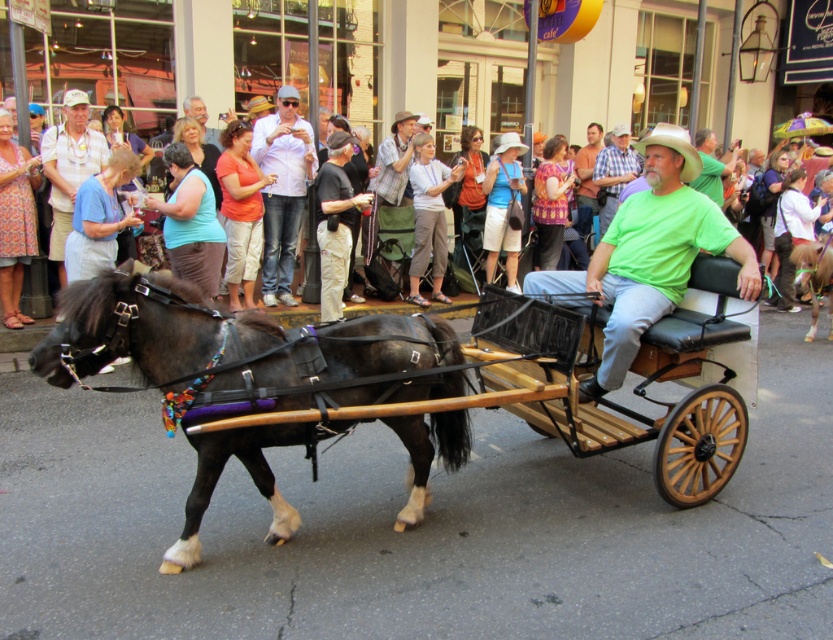
Question: Can you confirm if matte black horse at lower left is wider than gray hair at upper center?

Choices:
 (A) yes
 (B) no

Answer: (A)

Question: Which object is farther from the camera taking this photo?

Choices:
 (A) shiny black horse at center
 (B) green matte shirt at center
 (C) shiny brown pony at center
 (D) printed fabric dress at center

Answer: (C)

Question: Estimate the real-world distances between objects in this image. Which object is closer to the shiny black horse at center?

Choices:
 (A) gray hair at upper center
 (B) shiny brown pony at center
 (C) printed fabric dress at center
 (D) matte black horse at lower left

Answer: (D)

Question: Which object is the closest to the rustic brown cowboy hat at center?

Choices:
 (A) gray hair at upper center
 (B) shiny black horse at center
 (C) shiny brown pony at center

Answer: (A)

Question: Can you confirm if green matte shirt at center is wider than gray hair at upper center?

Choices:
 (A) no
 (B) yes

Answer: (B)

Question: Does shiny black horse at center appear over shiny brown pony at center?

Choices:
 (A) no
 (B) yes

Answer: (A)